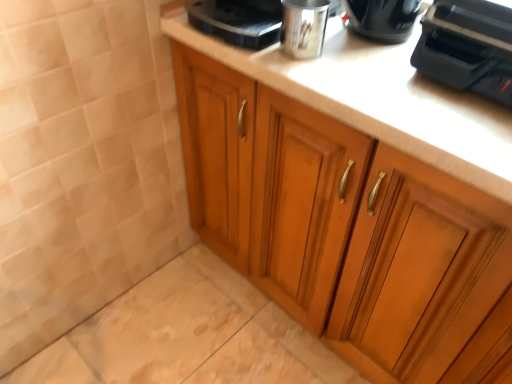
Question: Is wooden cabinet at center completely or partially outside of black plastic toaster at upper right?

Choices:
 (A) no
 (B) yes

Answer: (B)

Question: Is wooden cabinet at center touching black plastic toaster at upper right?

Choices:
 (A) no
 (B) yes

Answer: (A)

Question: From a real-world perspective, is wooden cabinet at center located higher than black plastic toaster at upper right?

Choices:
 (A) yes
 (B) no

Answer: (B)

Question: From the image's perspective, is wooden cabinet at center beneath black plastic toaster at upper right?

Choices:
 (A) no
 (B) yes

Answer: (B)

Question: Could you tell me if wooden cabinet at center is turned towards black plastic toaster at upper right?

Choices:
 (A) no
 (B) yes

Answer: (A)

Question: Considering the relative sizes of wooden cabinet at center and black plastic toaster at upper right in the image provided, is wooden cabinet at center thinner than black plastic toaster at upper right?

Choices:
 (A) no
 (B) yes

Answer: (A)

Question: Can you confirm if black plastic toaster at upper right is thinner than wooden cabinet at center?

Choices:
 (A) no
 (B) yes

Answer: (B)

Question: Could you tell me if black plastic toaster at upper right is turned towards wooden cabinet at center?

Choices:
 (A) no
 (B) yes

Answer: (A)

Question: From a real-world perspective, is black plastic toaster at upper right located beneath wooden cabinet at center?

Choices:
 (A) yes
 (B) no

Answer: (B)

Question: Considering the relative sizes of black plastic toaster at upper right and wooden cabinet at center in the image provided, is black plastic toaster at upper right smaller than wooden cabinet at center?

Choices:
 (A) yes
 (B) no

Answer: (A)

Question: From a real-world perspective, is black plastic toaster at upper right located higher than wooden cabinet at center?

Choices:
 (A) yes
 (B) no

Answer: (A)

Question: From the image's perspective, is black plastic toaster at upper right below wooden cabinet at center?

Choices:
 (A) yes
 (B) no

Answer: (B)

Question: In the image, is black plastic toaster at upper right on the left side or the right side of wooden cabinet at center?

Choices:
 (A) right
 (B) left

Answer: (A)